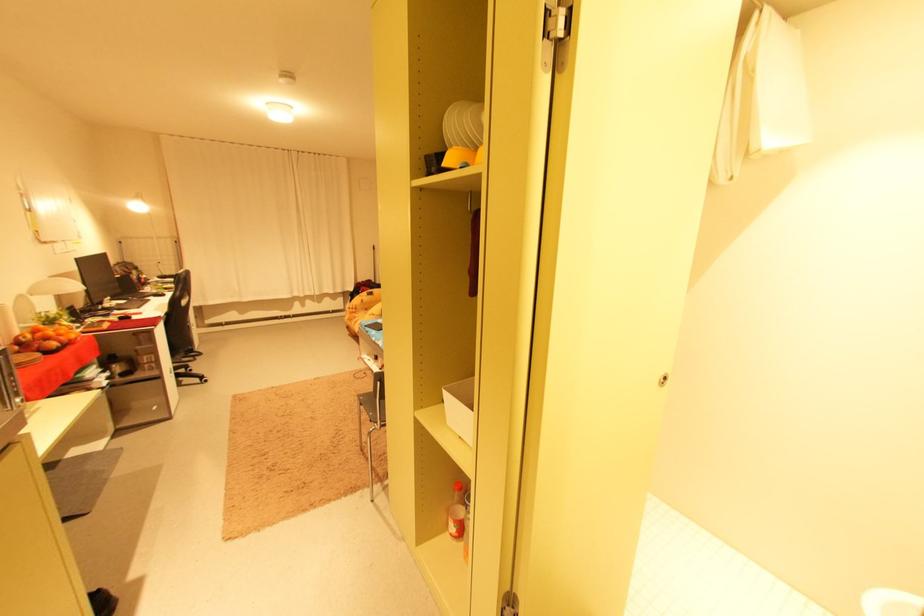
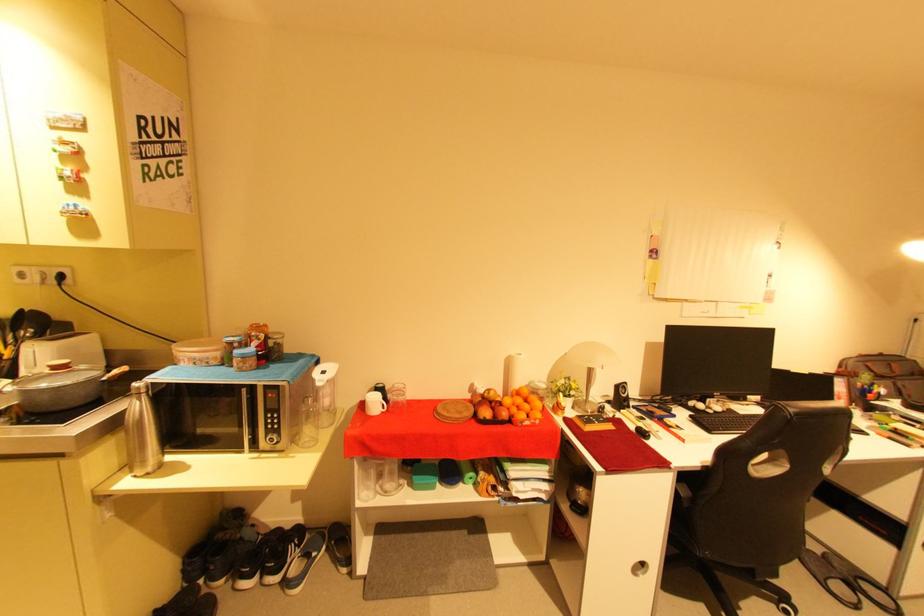
Where in the second image is the point corresponding to (x=68, y=344) from the first image?

(503, 416)